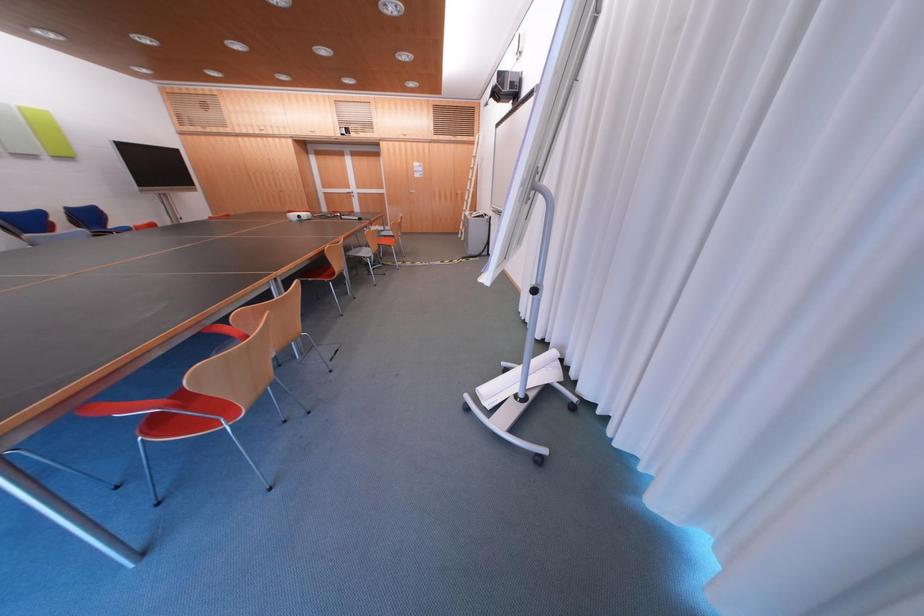
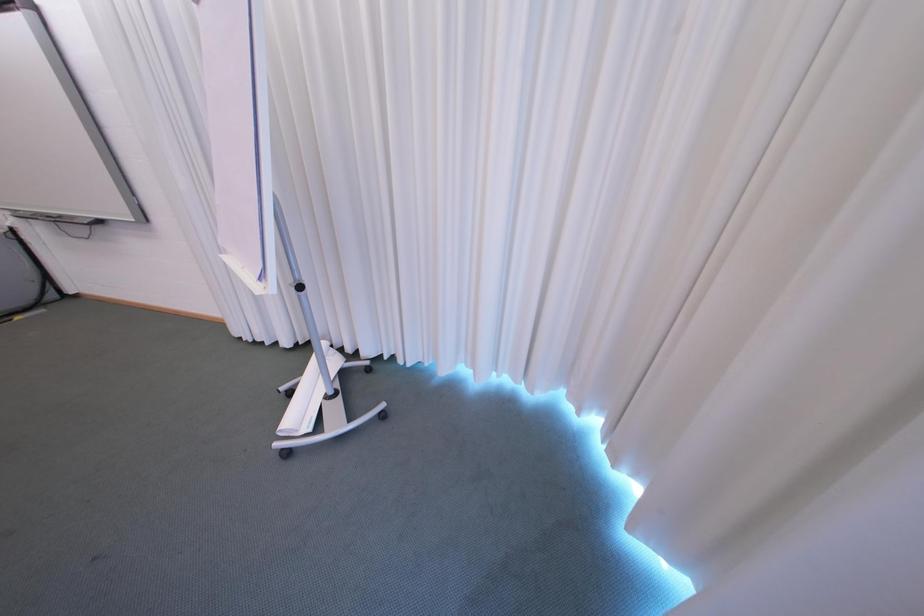
The images are taken continuously from a first-person perspective. In which direction is your viewpoint rotating?

The camera rotated toward right-down.